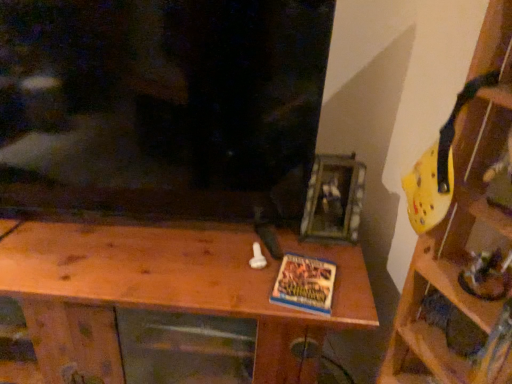
The height and width of the screenshot is (384, 512). I want to click on vacant area on top of wooden at center, positioned as the 1th shelf in left-to-right order (from a real-world perspective), so click(x=165, y=251).